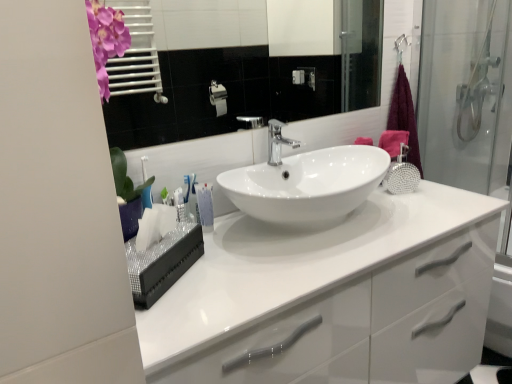
At what (x,y) coordinates should I click in order to perform the action: click on free space on the front side of white glossy tube at center. Please return your answer as a coordinate pair (x, y). The width and height of the screenshot is (512, 384). Looking at the image, I should click on (221, 256).